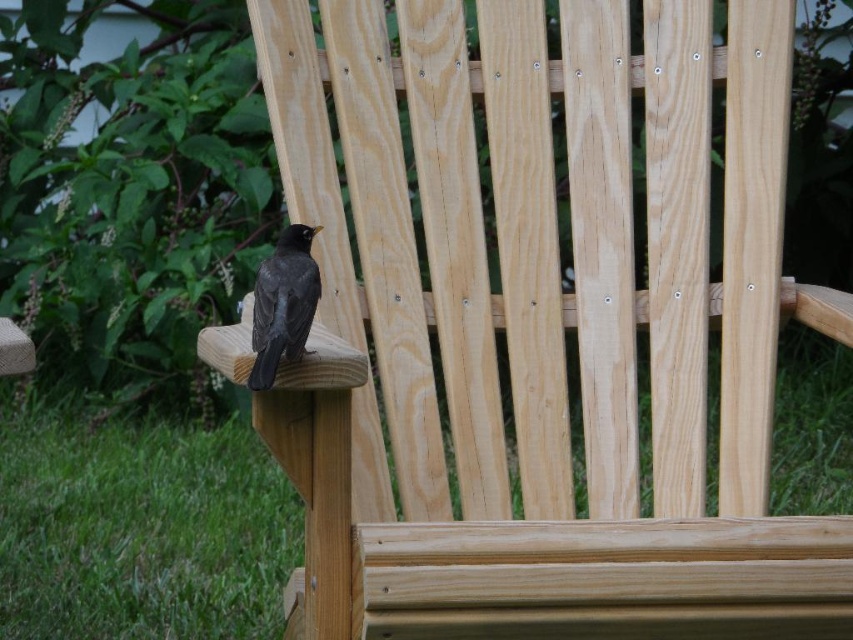
Does point (412, 566) come behind point (283, 243)?

No, (412, 566) is closer to viewer.

Between green grass at lower left and shiny black bird at left, which one is positioned lower?

green grass at lower left is lower down.

Is point (614, 552) closer to viewer compared to point (268, 365)?

That is False.

Locate an element on the screen. The height and width of the screenshot is (640, 853). green grass at lower left is located at coordinates (532, 554).